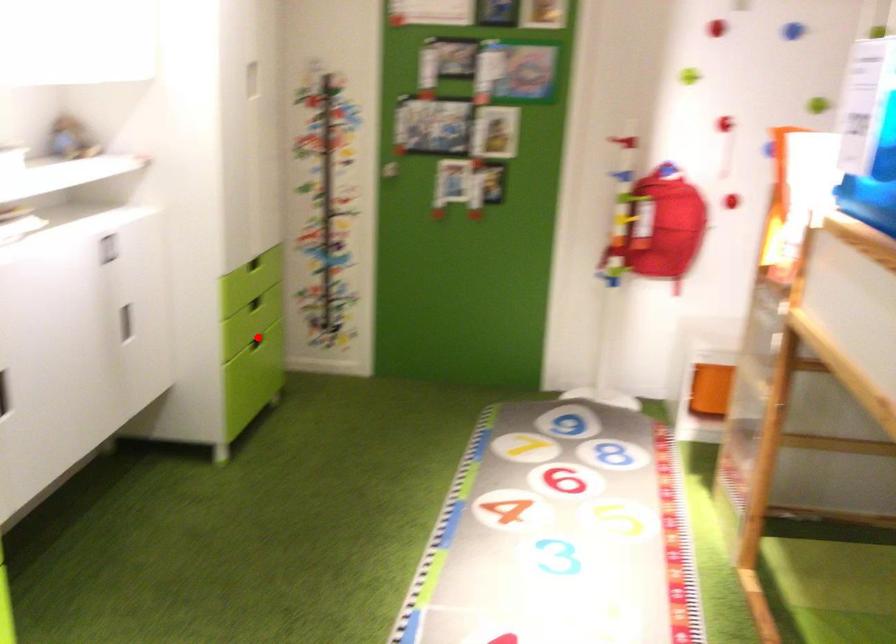
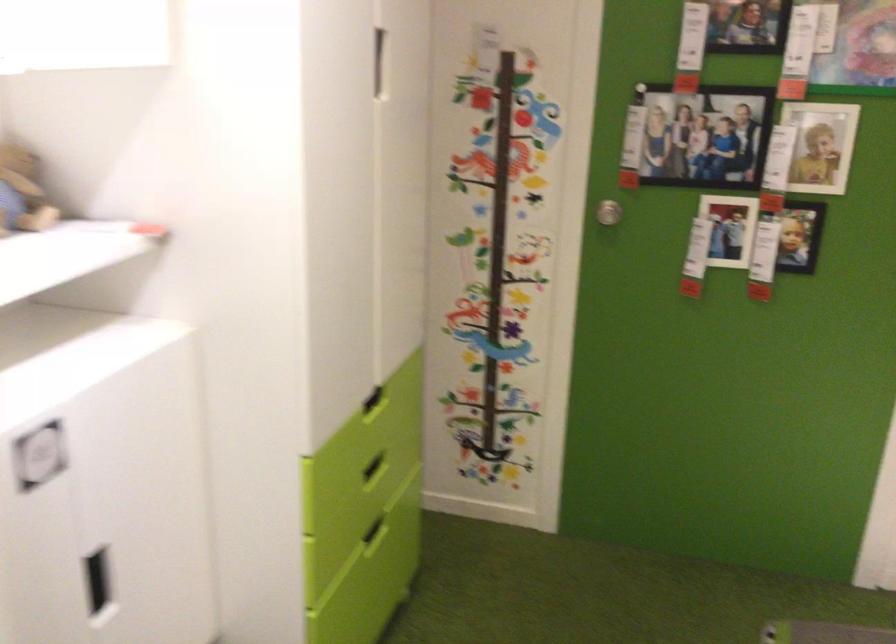
Question: I am providing you with two images of the same scene from different viewpoints. In image1, a red point is highlighted. Considering the same 3D point in image2, which of the following is correct?

Choices:
 (A) It is closer
 (B) It is farther

Answer: (A)